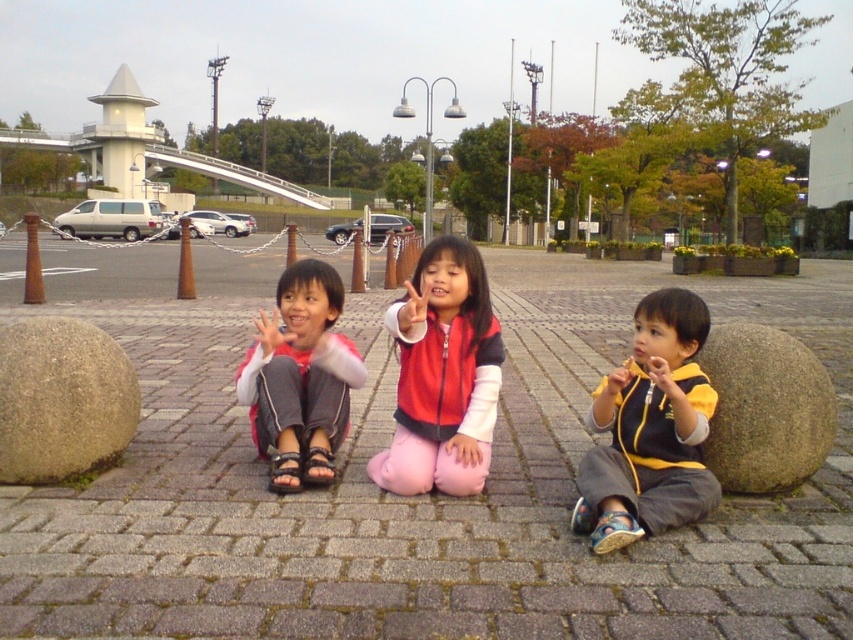
You are a photographer setting up a tripod in this scene. You need to place the tripod so that it doesn not block the view of the brown rough stone at left and the pink fabric pants at center. Given their heights, which object should the tripod be positioned closer to?

The brown rough stone at left has a lesser height compared to pink fabric pants at center. Therefore, the tripod should be positioned closer to the brown rough stone at left to ensure it doesn not block the view of the taller pink fabric pants at center.

You are a photographer trying to capture a photo of the children in the scene. You want to ensure the pink fabric pants at center are visible in the frame. Should you adjust your camera angle to the right or left to include the brown rough stone at left in the same shot?

The brown rough stone at left is positioned on the left side of pink fabric pants at center. To include both in the frame, you should adjust your camera angle to the left to capture the brown rough stone at left which is on the left side of the pink fabric pants at center.

You are standing at the center of the paved area where the children are sitting. You want to place a small marker exactly at the location of the brown rough stone at left. What are the coordinates where you should place the marker?

The coordinates for the brown rough stone at left are at point (x=62, y=400), so you should place the marker there.